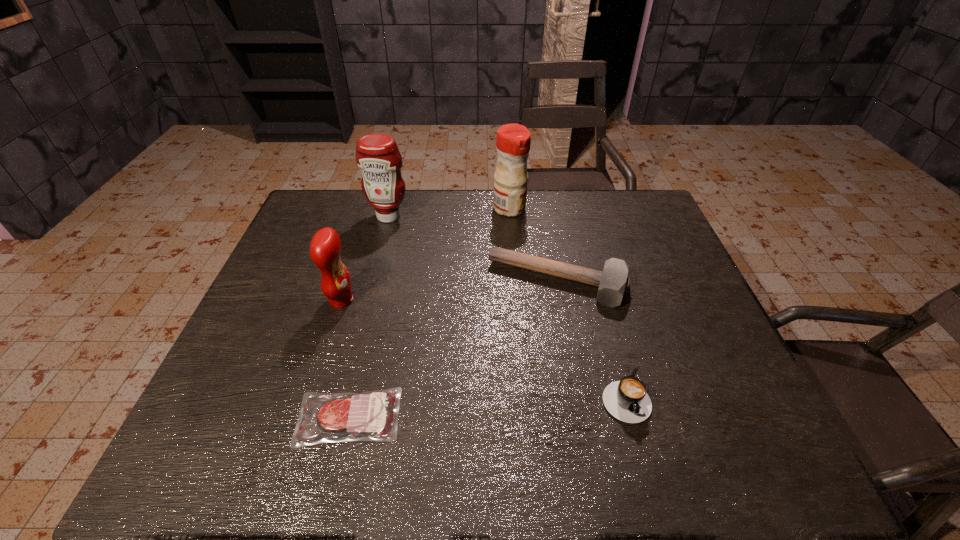
At what (x,y) coordinates should I click in order to perform the action: click on vacant area located 0.400m on the right of the shortest object. Please return your answer as a coordinate pair (x, y). This screenshot has height=540, width=960. Looking at the image, I should click on (594, 417).

Locate an element on the screen. object located in the near edge section of the desktop is located at coordinates (373, 415).

Image resolution: width=960 pixels, height=540 pixels. I want to click on free region at the near edge of the desktop, so click(659, 468).

The width and height of the screenshot is (960, 540). In the image, there is a desktop. In order to click on vacant region at the left edge in this screenshot , I will do `click(278, 395)`.

In the image, there is a desktop. Identify the location of vacant region at the right edge. (643, 307).

Where is `vacant space at the far left corner of the desktop`? The width and height of the screenshot is (960, 540). vacant space at the far left corner of the desktop is located at coordinates (345, 227).

The image size is (960, 540). I want to click on empty location between the shortest object and the rightmost condiment, so click(x=429, y=313).

I want to click on free space that is in between the mallet and the steak, so click(453, 349).

I want to click on free space between the shortest condiment and the rightmost condiment, so click(x=425, y=254).

Where is `unoccupied position between the cappuccino and the steak`? This screenshot has height=540, width=960. unoccupied position between the cappuccino and the steak is located at coordinates (487, 406).